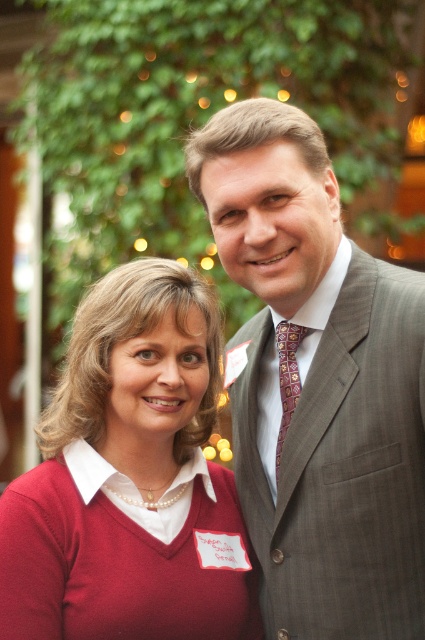
You are a photographer setting up for a group photo. You notice the matte red sweater at left and the patterned silk tie at center. Which object is positioned lower in the image?

The matte red sweater at left is below the patterned silk tie at center, so it is positioned lower in the image.

You are a photographer adjusting your camera settings to capture the scene. You need to ensure that both the matte red sweater at left and the patterned silk tie at center are in focus. Given their height difference, which object should you adjust your focus to prioritize first?

The matte red sweater at left has a greater height compared to the patterned silk tie at center, so you should prioritize focusing on the matte red sweater at left first since it is taller and might be more prominent in the frame.